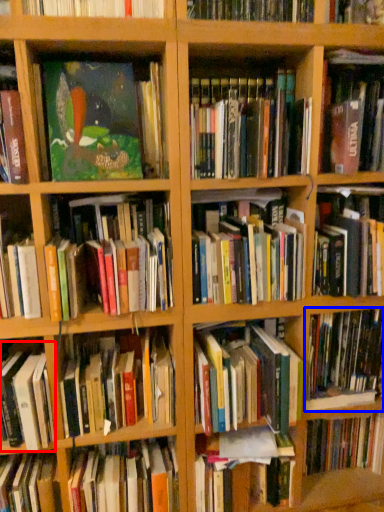
Question: Which point is closer to the camera, book (highlighted by a red box) or book (highlighted by a blue box)?

Choices:
 (A) book
 (B) book

Answer: (A)